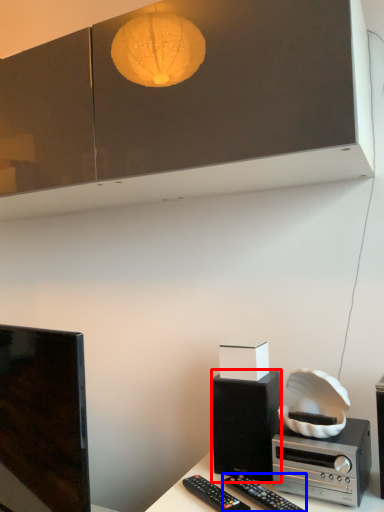
Question: Which point is further to the camera, loudspeaker (highlighted by a red box) or remote control (highlighted by a blue box)?

Choices:
 (A) loudspeaker
 (B) remote control

Answer: (A)